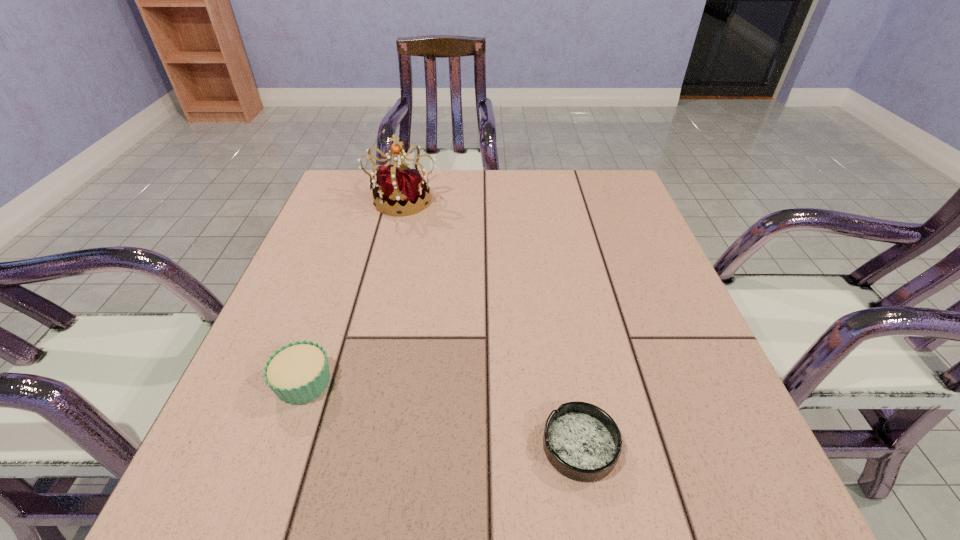
Identify the location of tiara. (402, 189).

Identify the location of the farthest object. The height and width of the screenshot is (540, 960). (402, 189).

The image size is (960, 540). What are the coordinates of `cupcake` in the screenshot? It's located at (297, 373).

Where is `the second tallest object`? This screenshot has height=540, width=960. the second tallest object is located at coordinates (297, 373).

Locate an element on the screen. the nearest object is located at coordinates point(581,441).

Locate an element on the screen. The width and height of the screenshot is (960, 540). the rightmost object is located at coordinates (581, 441).

The image size is (960, 540). In order to click on vacant space located on the front-facing side of the tallest object in this screenshot , I will do `click(394, 238)`.

Find the location of a particular element. vacant region located 0.320m on the back of the second nearest object is located at coordinates click(x=350, y=248).

This screenshot has height=540, width=960. Find the location of `vacant space located 0.050m on the left of the shortest object`. vacant space located 0.050m on the left of the shortest object is located at coordinates click(x=510, y=446).

Locate an element on the screen. The image size is (960, 540). object that is positioned at the far edge is located at coordinates (402, 189).